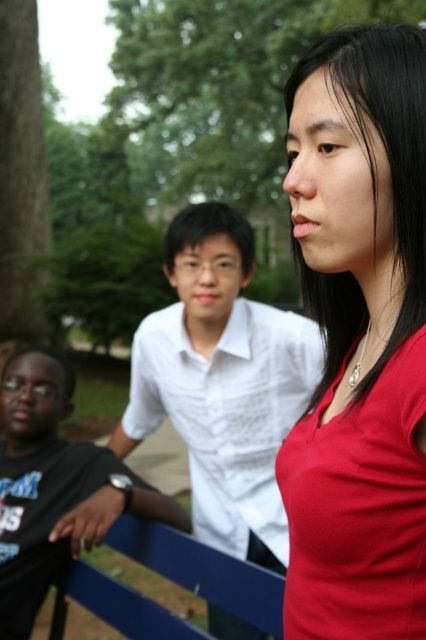
Which is behind, point (371, 252) or point (8, 509)?

Point (8, 509)

From the picture: Is matte red shirt at right wider than black matte shirt at left?

In fact, matte red shirt at right might be narrower than black matte shirt at left.

What do you see at coordinates (359, 339) in the screenshot?
I see `matte red shirt at right` at bounding box center [359, 339].

You are a GUI agent. You are given a task and a screenshot of the screen. Output one action in this format:
    pyautogui.click(x=<x>, y=<y>)
    Task: Click on the matte red shirt at right
    This screenshot has height=640, width=426.
    Given the screenshot: What is the action you would take?
    pyautogui.click(x=359, y=339)

Is matte red shirt at right shorter than white cotton shirt at center?

Indeed, matte red shirt at right has a lesser height compared to white cotton shirt at center.

Which is above, matte red shirt at right or white cotton shirt at center?

matte red shirt at right is above.

Which is behind, point (299, 179) or point (143, 392)?

The point (143, 392) is behind.

At what (x,y) coordinates should I click in order to perform the action: click on matte red shirt at right. Please return your answer as a coordinate pair (x, y). This screenshot has width=426, height=640. Looking at the image, I should click on (359, 339).

Is point (229, 438) closer to viewer compared to point (155, 493)?

No, it is not.

Between point (164, 390) and point (106, 458), which one is positioned behind?

Positioned behind is point (164, 390).

Does point (227, 208) come behind point (71, 445)?

No, it is not.

Locate an element on the screen. This screenshot has width=426, height=640. white cotton shirt at center is located at coordinates (222, 381).